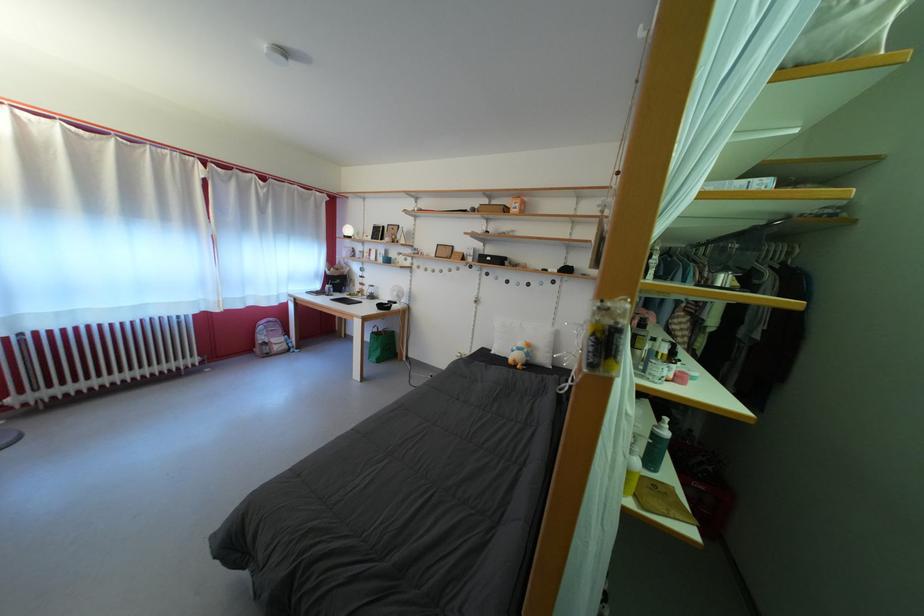
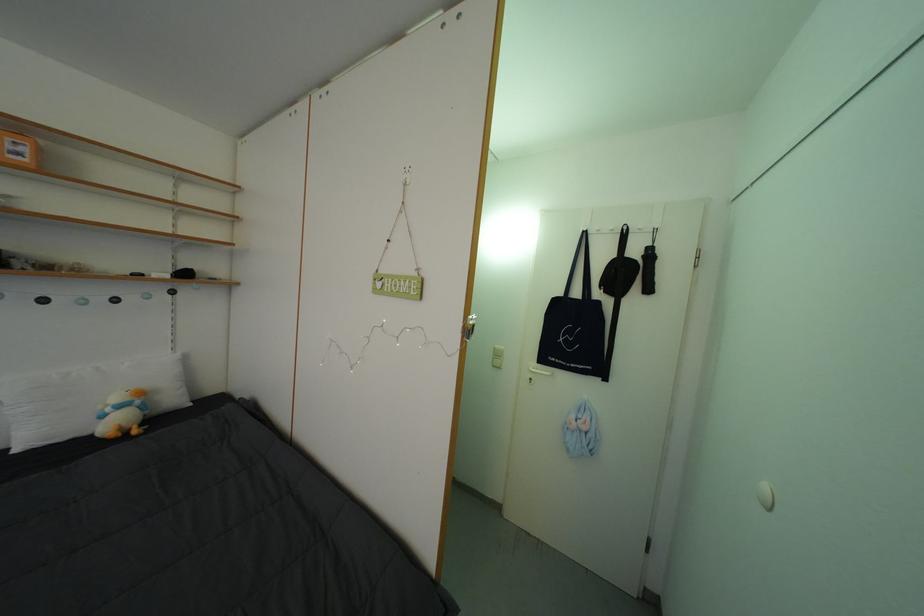
Question: Based on the continuous images, in which direction is the camera rotating? Reply with the corresponding letter.

Choices:
 (A) Left
 (B) Right
 (C) Up
 (D) Down

Answer: (B)